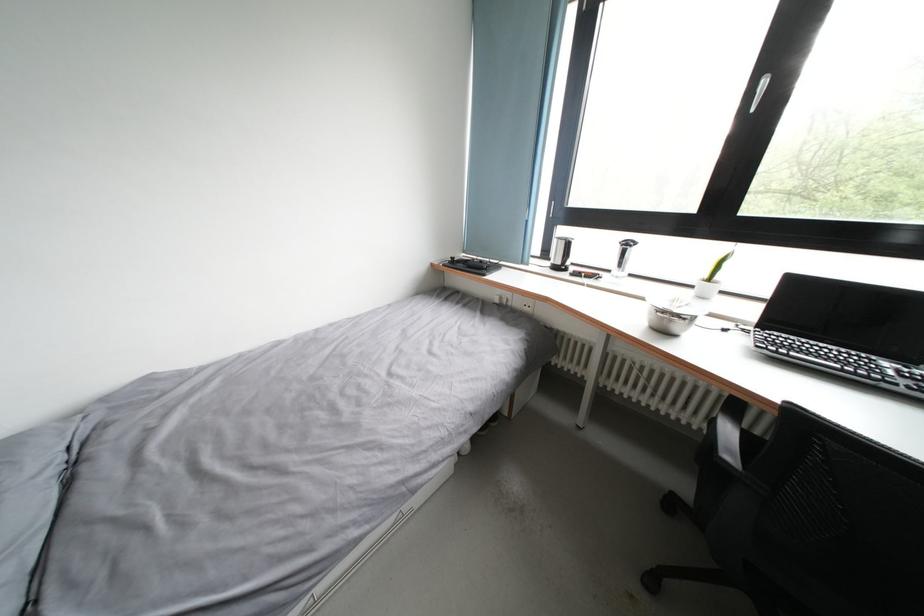
Identify the location of metal bed handle. Image resolution: width=924 pixels, height=616 pixels. [384, 536].